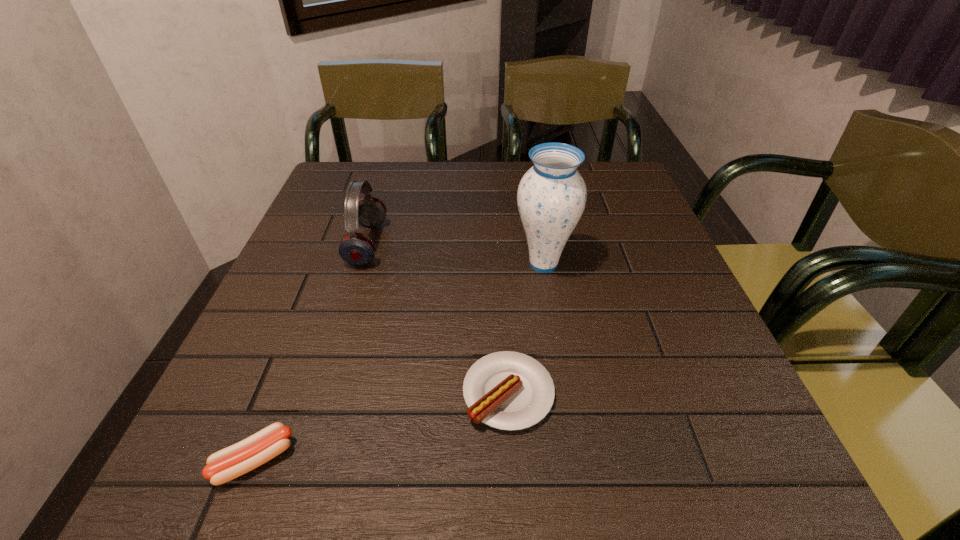
This screenshot has height=540, width=960. Identify the location of sausage that is positioned at the left edge. (229, 463).

You are a GUI agent. You are given a task and a screenshot of the screen. Output one action in this format:
    pyautogui.click(x=<x>, y=<y>)
    Task: Click on the object that is at the near left corner
    Image resolution: width=960 pixels, height=540 pixels.
    Given the screenshot: What is the action you would take?
    pyautogui.click(x=229, y=463)

Where is `vacant space at the far edge of the desktop`? vacant space at the far edge of the desktop is located at coordinates (423, 194).

The height and width of the screenshot is (540, 960). In the image, there is a desktop. Find the location of `vacant space at the near edge`. vacant space at the near edge is located at coordinates (637, 465).

Locate an element on the screen. vacant area at the left edge is located at coordinates (228, 399).

This screenshot has height=540, width=960. I want to click on vacant space at the right edge of the desktop, so click(x=593, y=227).

I want to click on vacant area at the far left corner, so click(359, 178).

The width and height of the screenshot is (960, 540). Identify the location of free location at the near left corner. (193, 468).

This screenshot has height=540, width=960. Identify the location of vacant region at the far right corner of the desktop. (623, 165).

I want to click on unoccupied position between the left sausage and the right sausage, so click(x=381, y=427).